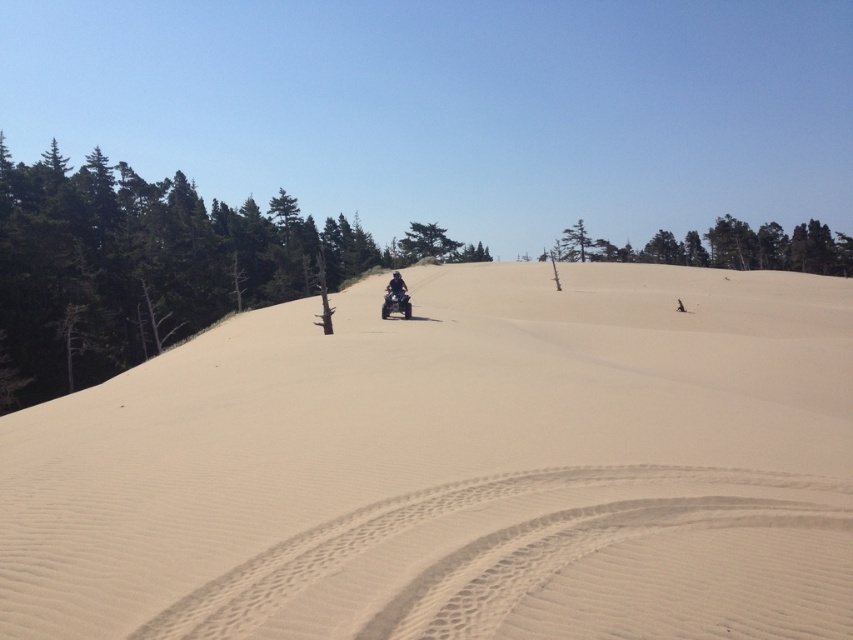
Is green textured tree at center bigger than metallic silver quad bike at center?

Indeed, green textured tree at center has a larger size compared to metallic silver quad bike at center.

Who is positioned more to the left, green textured tree at center or metallic silver quad bike at center?

From the viewer's perspective, green textured tree at center appears more on the left side.

Describe the element at coordinates (426, 241) in the screenshot. The width and height of the screenshot is (853, 640). I see `green textured tree at center` at that location.

This screenshot has width=853, height=640. I want to click on green textured tree at center, so click(426, 241).

Who is more distant from viewer, (x=666, y=260) or (x=392, y=307)?

Point (x=666, y=260)

Who is positioned more to the left, green textured tree at upper center or metallic silver quad bike at center?

metallic silver quad bike at center

Is point (817, 268) closer to viewer compared to point (410, 314)?

No, it is behind (410, 314).

Identify the location of green textured tree at upper center. (724, 248).

Is the position of smooth sand dune at center more distant than that of smooth sand at center?

That is False.

Between smooth sand dune at center and smooth sand at center, which one is positioned lower?

smooth sand at center is lower down.

This screenshot has height=640, width=853. In order to click on smooth sand dune at center in this screenshot , I will do `click(456, 468)`.